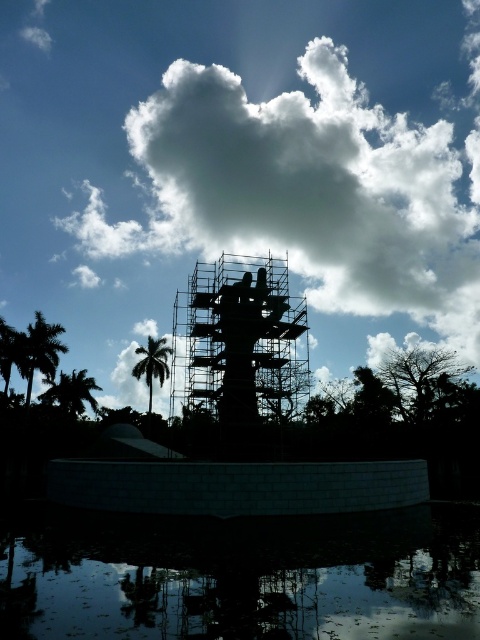
From the picture: You are an architect standing in front of the sculpture base. You see the scaffolding metal structure at center and the green leafy palm tree at center. Which object is located to the right of the other?

The scaffolding metal structure at center is positioned on the right side of green leafy palm tree at center.

You are standing at the center of the circular platform where the base of the sculpture is located. Looking towards the scaffolding metal structure at center, what are the coordinates of its position relative to your current location?

The scaffolding metal structure at center is located at coordinates point (240, 344) relative to your position at the center of the circular platform.

You are an architect standing in front of the sculpture and want to take a photo of both the scaffolding metal structure at center and the green leafy palm tree at center. Which object should you focus on first to ensure both are in clear view?

You should focus on the scaffolding metal structure at center first because it is closer to the viewer than the green leafy palm tree at center, ensuring both are in clear view when focusing on the closer object.